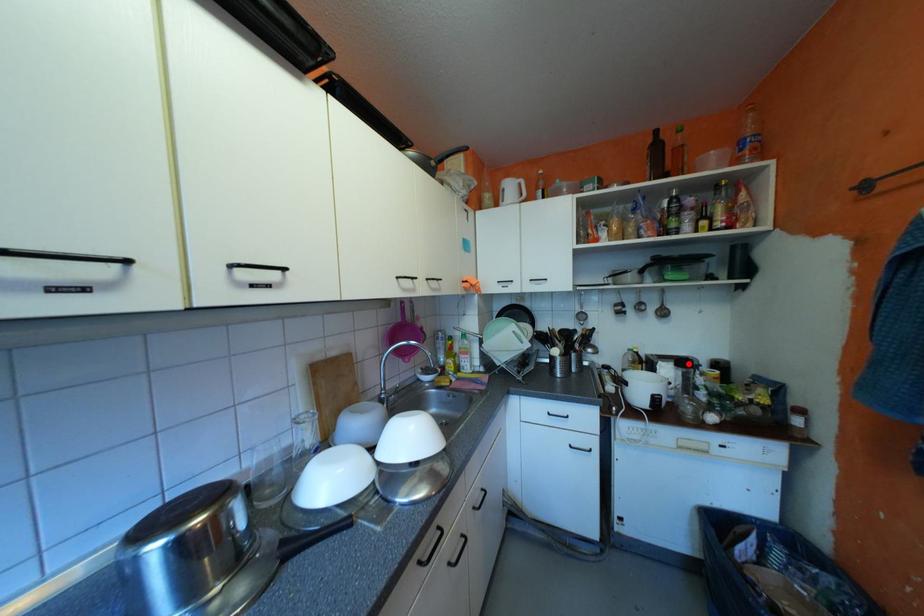
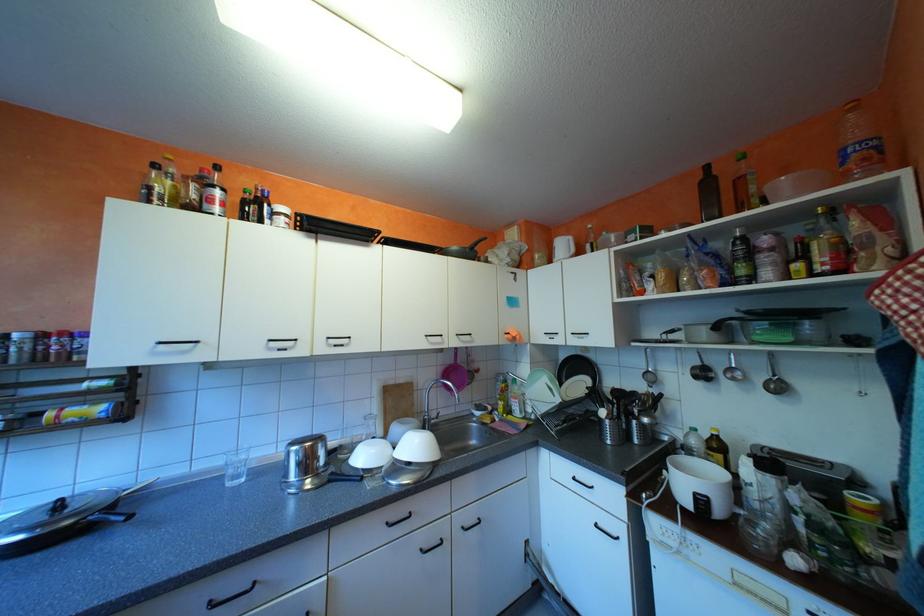
Where in the second image is the point corresponding to the highlighted location from the first image?

(771, 464)